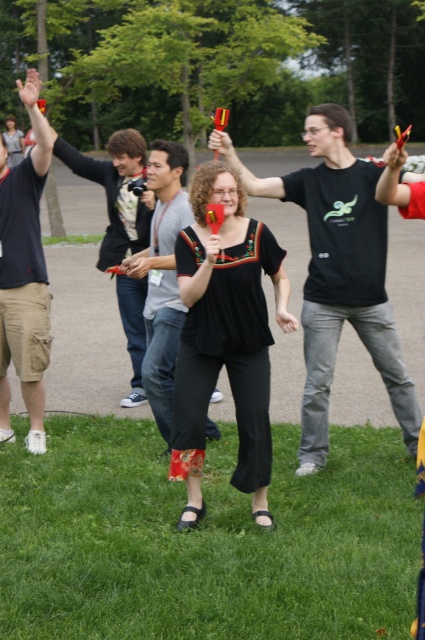
You are standing in the park scene and want to reach the point at coordinates point (351, 301). If you can walk 20 feet per minute, how long will it take you to reach that point?

The point (351, 301) is 15.84 feet from the viewer. At a walking speed of 20 feet per minute, it would take 15.84 divided by 20, which equals 0.792 minutes, or approximately 48 seconds to reach the point.